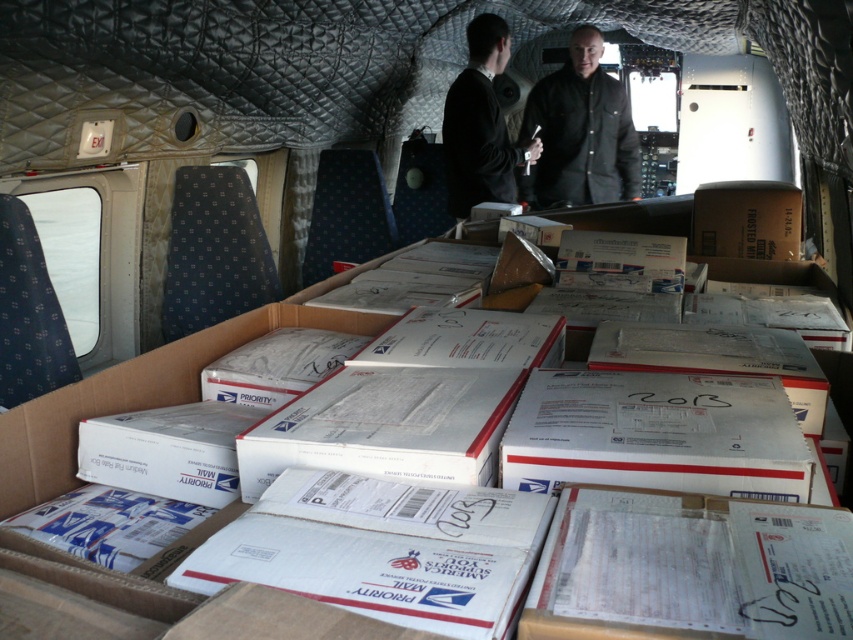
Is point (544, 141) in front of point (483, 68)?

No, it is behind (483, 68).

Can you confirm if black matte jacket at center is wider than black matte suit at center?

Yes, black matte jacket at center is wider than black matte suit at center.

The width and height of the screenshot is (853, 640). Find the location of `black matte jacket at center`. black matte jacket at center is located at coordinates (579, 132).